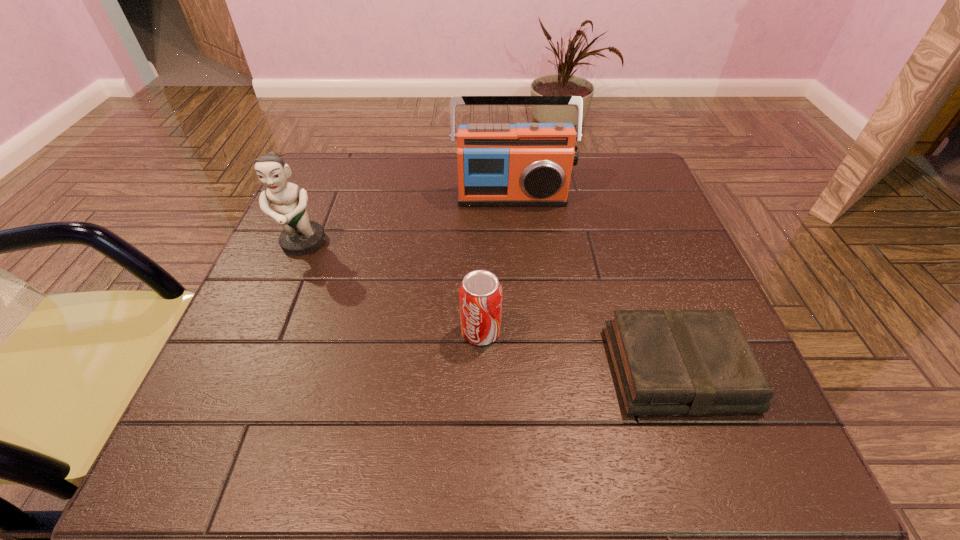
Point out which object is positioned as the nearest to the second shortest object. Please provide its 2D coordinates. Your answer should be formatted as a tuple, i.e. [(x, y)], where the tuple contains the x and y coordinates of a point satisfying the conditions above.

[(666, 362)]

Locate which object is the third closest to the radio receiver. Please provide its 2D coordinates. Your answer should be formatted as a tuple, i.e. [(x, y)], where the tuple contains the x and y coordinates of a point satisfying the conditions above.

[(666, 362)]

Identify the location of free spot that satisfies the following two spatial constraints: 1. on the front side of the soda can; 2. on the right side of the shortest object. This screenshot has height=540, width=960. (481, 369).

Image resolution: width=960 pixels, height=540 pixels. Find the location of `vacant area in the image that satisfies the following two spatial constraints: 1. on the front-facing side of the third tallest object; 2. on the left side of the leftmost object`. vacant area in the image that satisfies the following two spatial constraints: 1. on the front-facing side of the third tallest object; 2. on the left side of the leftmost object is located at coordinates (266, 332).

Identify the location of free space that satisfies the following two spatial constraints: 1. on the front-facing side of the shortest object; 2. on the left side of the farthest object. The width and height of the screenshot is (960, 540). (526, 369).

Where is `free space that satisfies the following two spatial constraints: 1. on the front-facing side of the third tallest object; 2. on the left side of the leftmost object`? The width and height of the screenshot is (960, 540). free space that satisfies the following two spatial constraints: 1. on the front-facing side of the third tallest object; 2. on the left side of the leftmost object is located at coordinates (266, 332).

Locate an element on the screen. Image resolution: width=960 pixels, height=540 pixels. blank area in the image that satisfies the following two spatial constraints: 1. on the front-facing side of the third tallest object; 2. on the right side of the second farthest object is located at coordinates (266, 332).

Identify the location of free space that satisfies the following two spatial constraints: 1. on the front-facing side of the shortest object; 2. on the right side of the third nearest object. This screenshot has height=540, width=960. (251, 369).

Where is `vacant position in the image that satisfies the following two spatial constraints: 1. on the front-facing side of the radio receiver; 2. on the right side of the book`? The width and height of the screenshot is (960, 540). vacant position in the image that satisfies the following two spatial constraints: 1. on the front-facing side of the radio receiver; 2. on the right side of the book is located at coordinates (526, 369).

This screenshot has width=960, height=540. I want to click on free region that satisfies the following two spatial constraints: 1. on the front-facing side of the book; 2. on the right side of the second farthest object, so click(251, 369).